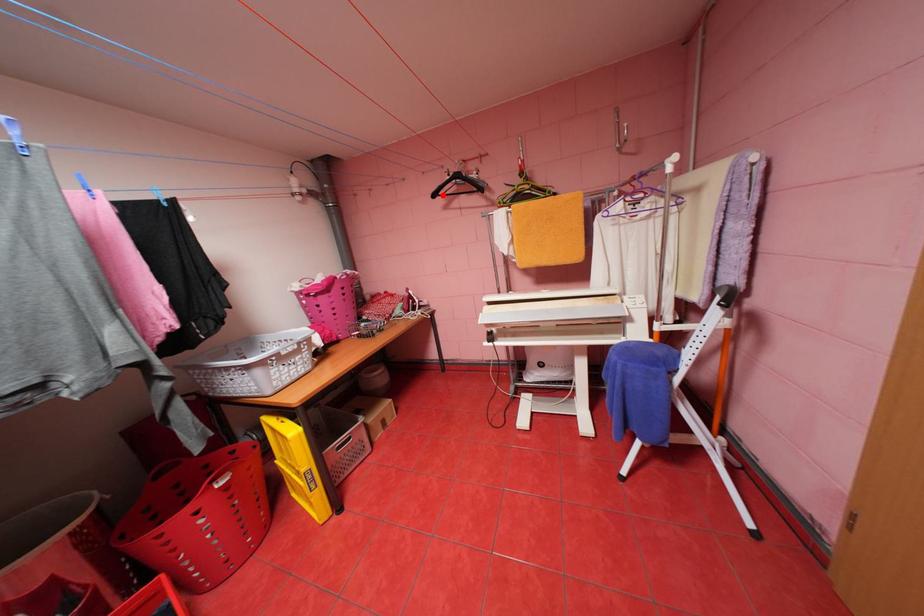
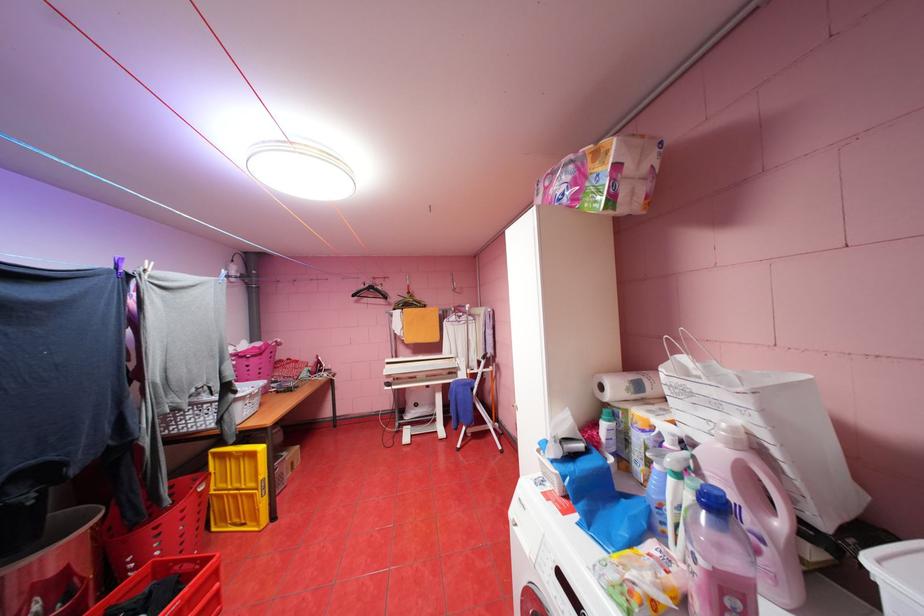
Find the pixel in the second image that matches the highlighted location in the first image.

(361, 294)